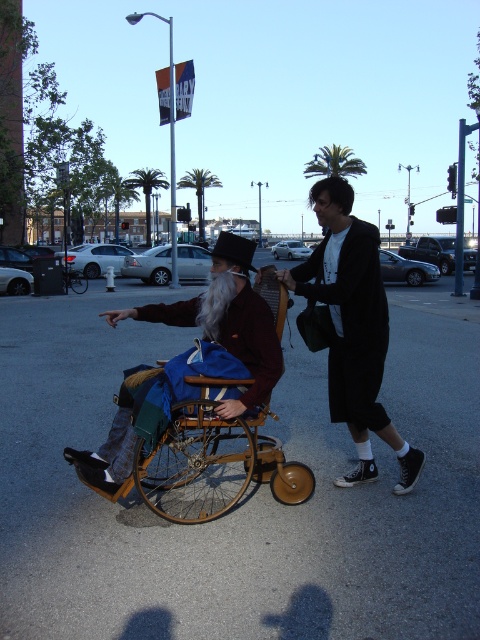
Can you confirm if black leather jacket at center is bigger than wooden wheelchair at center?

No.

Between point (355, 355) and point (222, 464), which one is positioned in front?

Point (355, 355) is in front.

Image resolution: width=480 pixels, height=640 pixels. Find the location of `black leather jacket at center`. black leather jacket at center is located at coordinates (352, 328).